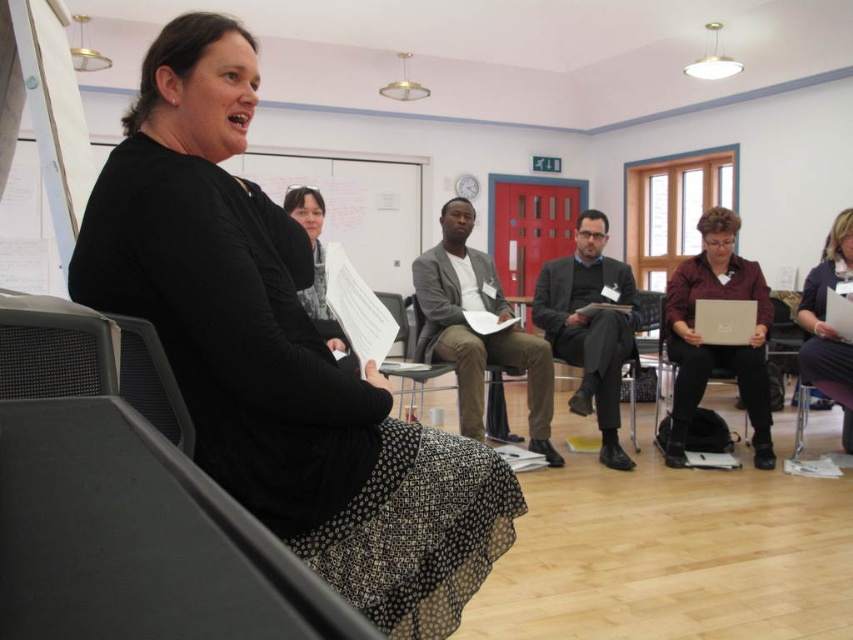
Is gray fabric suit at center above white matte laptop at center?

Incorrect, gray fabric suit at center is not positioned above white matte laptop at center.

The width and height of the screenshot is (853, 640). In order to click on gray fabric suit at center in this screenshot , I will do `click(474, 332)`.

Identify the location of gray fabric suit at center. (474, 332).

Measure the distance between point (735,310) and camera.

Point (735,310) is 3.96 meters away from camera.

From the picture: Between white matte laptop at center and metallic gray chair at center, which one is positioned higher?

white matte laptop at center is above.

Is point (700, 333) more distant than point (502, 422)?

No, (700, 333) is closer to viewer.

Where is `white matte laptop at center`? The width and height of the screenshot is (853, 640). white matte laptop at center is located at coordinates (724, 321).

Between purple fabric skirt at lower right and white matte laptop at center, which one is positioned lower?

white matte laptop at center is lower down.

In order to click on purple fabric skirt at lower right in this screenshot , I will do (828, 324).

The image size is (853, 640). What do you see at coordinates (828, 324) in the screenshot?
I see `purple fabric skirt at lower right` at bounding box center [828, 324].

Identify the location of purple fabric skirt at lower right. (828, 324).